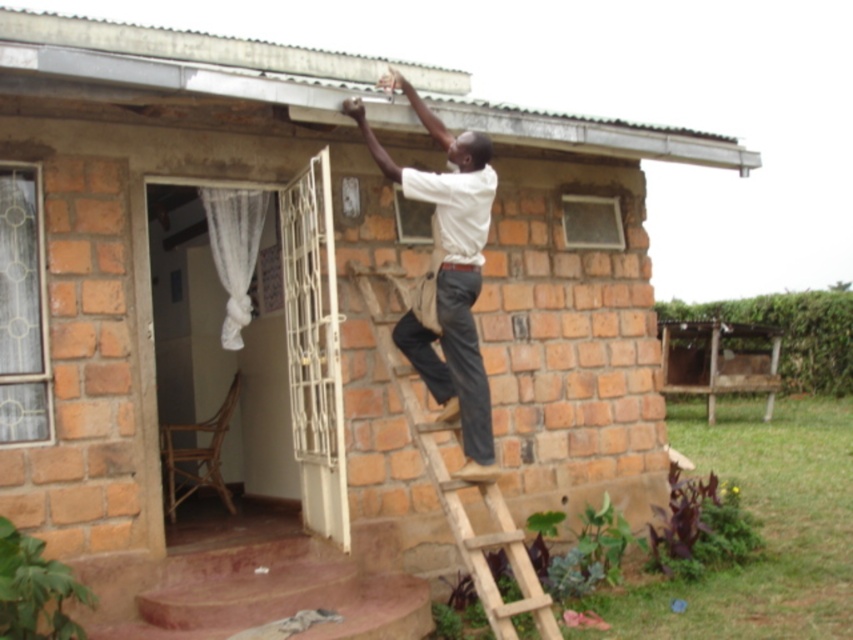
You are a painter standing on the ground and need to determine which object is bigger between the white shirt at upper center and the white sheer curtain at left. Based on the scene, which one is larger?

The white shirt at upper center is larger in size than the white sheer curtain at left according to the description.

You are a window installer observing the house. You notice the white shirt at upper center and the white sheer curtain at left. Which object is closer to the ground?

The white shirt at upper center is positioned under the white sheer curtain at left, meaning it is closer to the ground.

You are standing at a point labeled as point (x=405, y=292) and want to take a photo of the man on the roof. If your camera has a maximum focus range of 5 meters, will you be able to capture a clear image of him?

The distance between point (x=405, y=292) and the camera is 5.73 meters, which exceeds the camera maximum focus range of 5 meters. Therefore, you won not be able to capture a clear image of him.